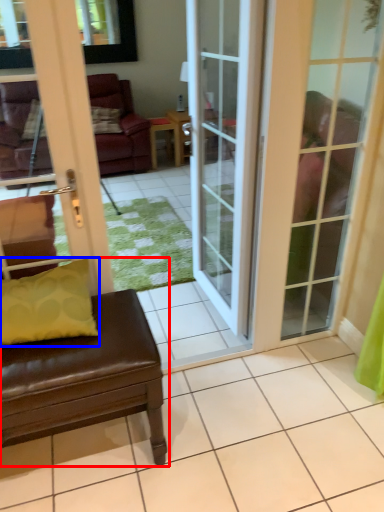
Question: Which point is further to the camera, studio couch (highlighted by a red box) or pillow (highlighted by a blue box)?

Choices:
 (A) studio couch
 (B) pillow

Answer: (B)